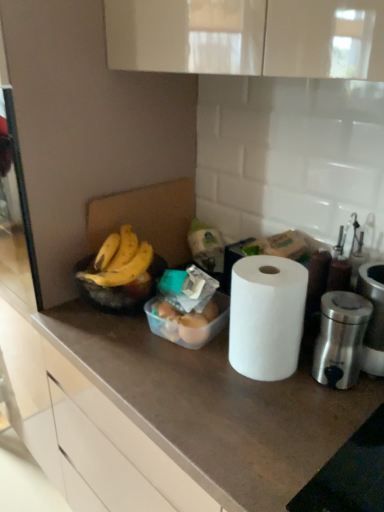
You are a GUI agent. You are given a task and a screenshot of the screen. Output one action in this format:
    pyautogui.click(x=<x>, y=<y>)
    Task: Click on the free region on the left part of white matte paper towel at center
    The width and height of the screenshot is (384, 512).
    Given the screenshot: What is the action you would take?
    (180, 374)